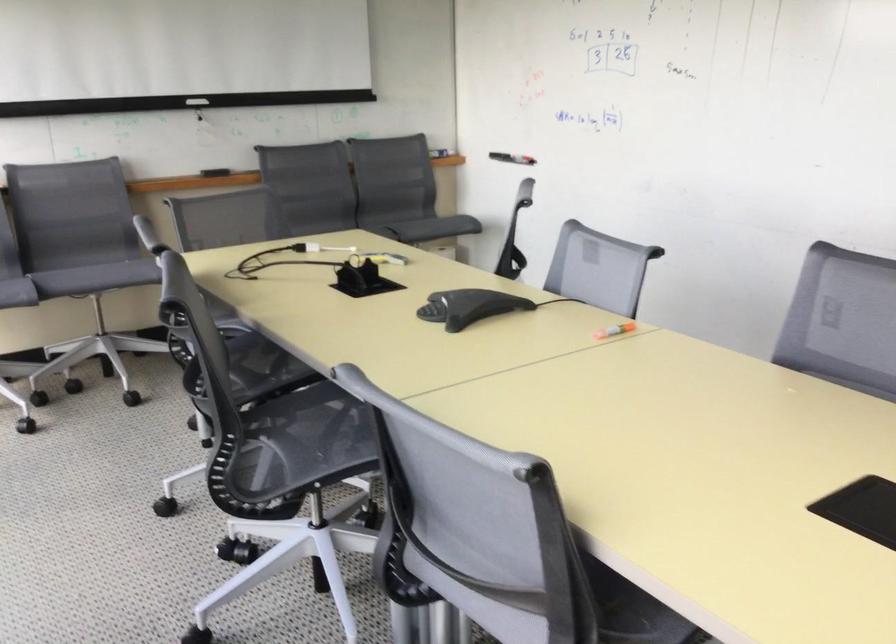
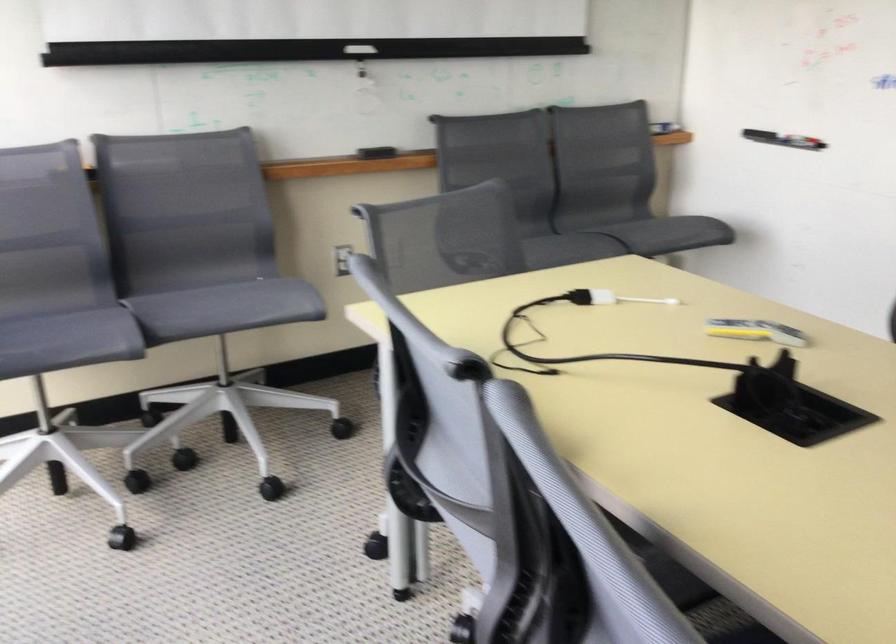
In the second image, find the point that corresponds to point (321, 250) in the first image.

(610, 298)